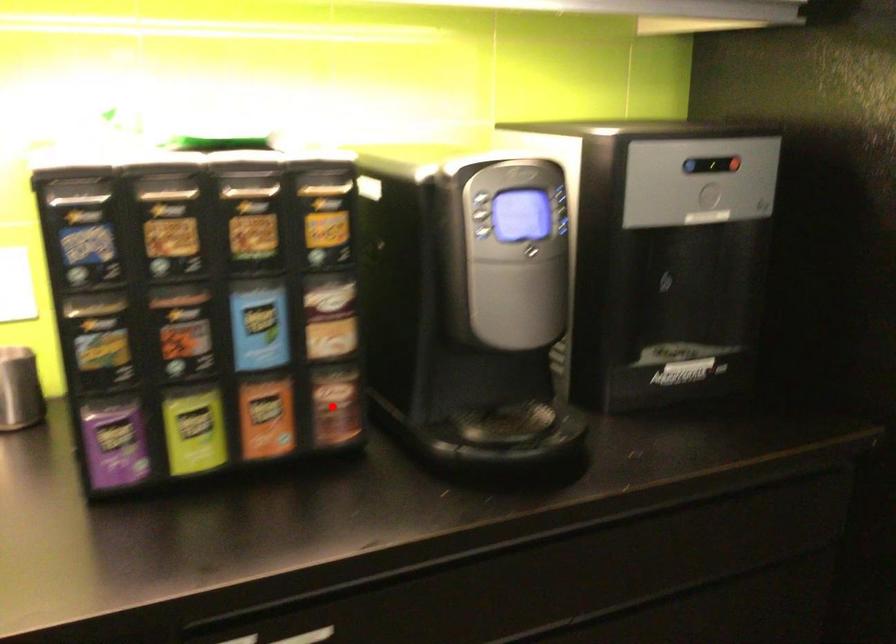
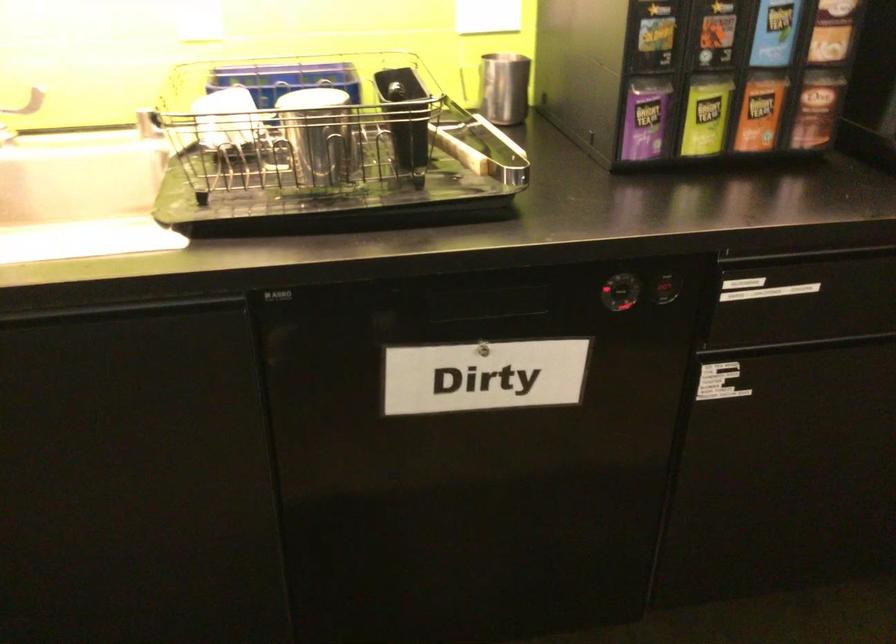
Locate, in the second image, the point that corresponds to the highlighted location in the first image.

(816, 109)